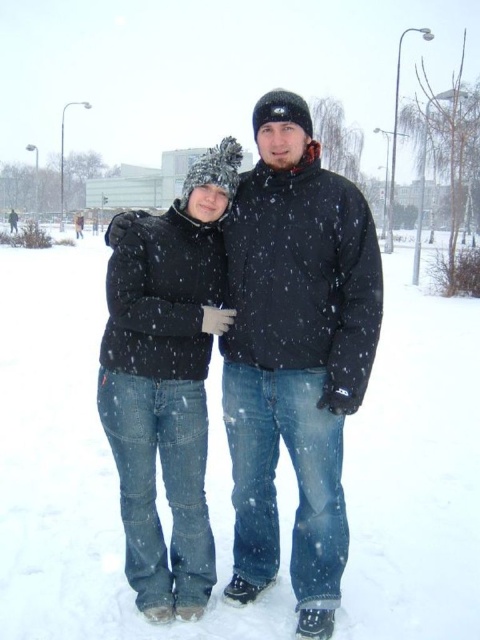
Locate an element on the screen. matte black jacket at center is located at coordinates (296, 355).